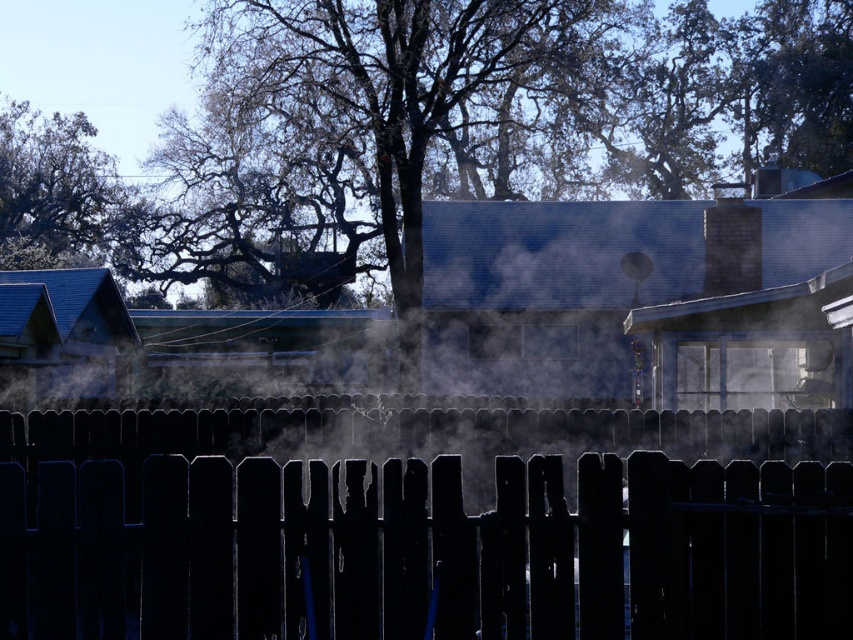
You are a painter who needs to paint both the black wood fence at center and the black brick chimney at upper right. You have a limited amount of paint and want to know which object requires more paint based on their widths. Can you determine which one is wider?

The black wood fence at center might be wider than black brick chimney at upper right, so it likely requires more paint.